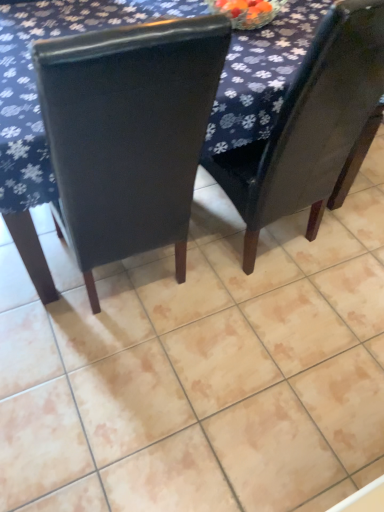
Question: Could you tell me if matte black chair at center, acting as the 2th chair starting from the right, is facing dark blue fabric at upper center?

Choices:
 (A) no
 (B) yes

Answer: (B)

Question: From a real-world perspective, is matte black chair at center, which appears as the 1th chair when viewed from the left, positioned under dark blue fabric at upper center based on gravity?

Choices:
 (A) no
 (B) yes

Answer: (A)

Question: Does matte black chair at center, which appears as the 1th chair when viewed from the left, appear on the right side of dark blue fabric at upper center?

Choices:
 (A) no
 (B) yes

Answer: (A)

Question: Can you confirm if matte black chair at center, acting as the 2th chair starting from the right, is thinner than dark blue fabric at upper center?

Choices:
 (A) no
 (B) yes

Answer: (B)

Question: Does matte black chair at center, which appears as the 1th chair when viewed from the left, come behind dark blue fabric at upper center?

Choices:
 (A) yes
 (B) no

Answer: (B)

Question: Considering the relative positions of dark blue fabric at upper center and matte black chair at center, acting as the 1th chair starting from the right, in the image provided, is dark blue fabric at upper center to the left or to the right of matte black chair at center, acting as the 1th chair starting from the right,?

Choices:
 (A) left
 (B) right

Answer: (A)

Question: Is dark blue fabric at upper center situated inside matte black chair at center, which ranks as the second chair in left-to-right order, or outside?

Choices:
 (A) inside
 (B) outside

Answer: (B)

Question: From the image's perspective, is dark blue fabric at upper center above or below matte black chair at center, which ranks as the second chair in left-to-right order?

Choices:
 (A) below
 (B) above

Answer: (B)

Question: Relative to matte black chair at center, acting as the 1th chair starting from the right, is dark blue fabric at upper center in front or behind?

Choices:
 (A) behind
 (B) front

Answer: (A)

Question: Is matte black chair at center, which appears as the 1th chair when viewed from the left, situated inside matte black chair at center, acting as the 1th chair starting from the right, or outside?

Choices:
 (A) inside
 (B) outside

Answer: (B)

Question: Is matte black chair at center, acting as the 2th chair starting from the right, wider or thinner than matte black chair at center, which ranks as the second chair in left-to-right order?

Choices:
 (A) wide
 (B) thin

Answer: (A)

Question: Based on their sizes in the image, would you say matte black chair at center, which appears as the 1th chair when viewed from the left, is bigger or smaller than matte black chair at center, which ranks as the second chair in left-to-right order?

Choices:
 (A) big
 (B) small

Answer: (A)

Question: From a real-world perspective, is matte black chair at center, which appears as the 1th chair when viewed from the left, positioned above or below matte black chair at center, acting as the 1th chair starting from the right?

Choices:
 (A) above
 (B) below

Answer: (B)

Question: Considering the relative positions of matte black chair at center, which ranks as the second chair in left-to-right order, and dark blue fabric at upper center in the image provided, is matte black chair at center, which ranks as the second chair in left-to-right order, to the left or to the right of dark blue fabric at upper center?

Choices:
 (A) right
 (B) left

Answer: (A)

Question: In the image, is matte black chair at center, which ranks as the second chair in left-to-right order, positioned in front of or behind dark blue fabric at upper center?

Choices:
 (A) front
 (B) behind

Answer: (A)